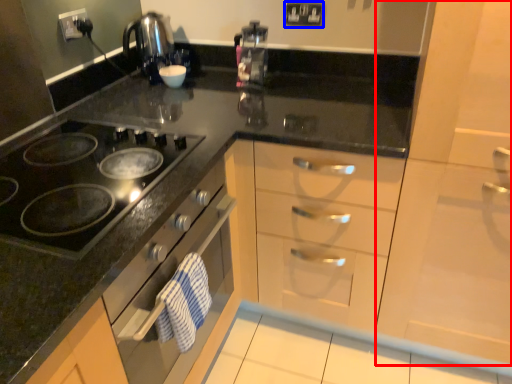
Question: Which point is closer to the camera, cabinetry (highlighted by a red box) or electric outlet (highlighted by a blue box)?

Choices:
 (A) cabinetry
 (B) electric outlet

Answer: (A)